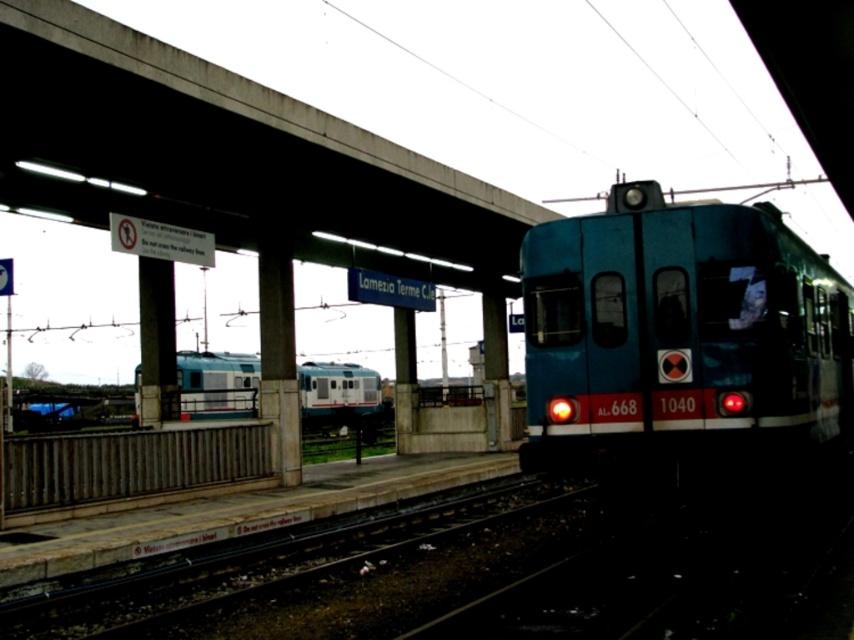
Does teal glossy train at right have a larger size compared to blue glossy train at center?

No, teal glossy train at right is not bigger than blue glossy train at center.

Between point (730, 371) and point (205, 372), which one is positioned behind?

Point (205, 372)

Image resolution: width=854 pixels, height=640 pixels. I want to click on teal glossy train at right, so click(680, 337).

Who is shorter, concrete at upper center or teal glossy train at right?

With less height is concrete at upper center.

This screenshot has height=640, width=854. What do you see at coordinates (229, 157) in the screenshot?
I see `concrete at upper center` at bounding box center [229, 157].

The image size is (854, 640). In order to click on concrete at upper center in this screenshot , I will do `click(229, 157)`.

I want to click on concrete at upper center, so coord(229,157).

Who is taller, concrete at upper center or blue glossy train at center?

blue glossy train at center is taller.

Which is behind, point (347, 253) or point (349, 410)?

Positioned behind is point (349, 410).

The width and height of the screenshot is (854, 640). I want to click on concrete at upper center, so click(229, 157).